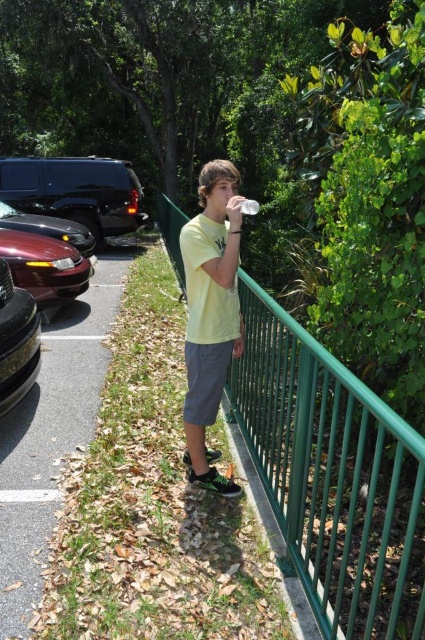
Consider the image. You are standing at the point marked by the coordinates point (76, 192). What object is located at that point in the scene?

The point (76, 192) corresponds to the shiny black SUV at left.

In the scene shown: You are a parking attendant who needs to direct a visitor to park their car between the shiny black suv at left and the shiny black car at left. Which vehicle should they park closer to in order to be between them?

The visitor should park closer to the shiny black car at left because the shiny black suv at left is further away from the viewer, so positioning the car near the closer one ensures it is between both vehicles.

Consider the image. You are a delivery robot that needs to cross the parking area to deliver a package. You see the asphalt at lower left and the shiny maroon sedan at left. Which surface can you drive over?

The asphalt at lower left is shorter than the shiny maroon sedan at left, so the delivery robot can drive over the asphalt at lower left since it is a drivable surface.